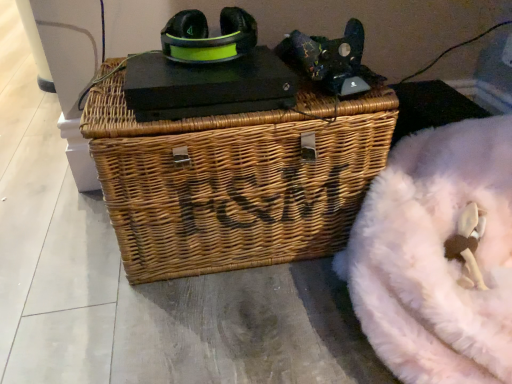
What is the approximate width of white fluffy bean bag at lower right, which is the 1th bean bag chair from bottom to top?

white fluffy bean bag at lower right, which is the 1th bean bag chair from bottom to top, is 58.94 centimeters in width.

Identify the location of woven brown picnic basket at center. (234, 179).

What is the approximate width of velvet-like pink bean bag at upper right, positioned as the 1th bean bag chair in top-to-bottom order?

It is 6.37 inches.

You are a GUI agent. You are given a task and a screenshot of the screen. Output one action in this format:
    pyautogui.click(x=<x>, y=<y>)
    Task: Click on the white fluffy bean bag at lower right, positioned as the second bean bag chair in top-to-bottom order
    
    Given the screenshot: What is the action you would take?
    pyautogui.click(x=438, y=255)

Which point is more distant from viewer, (184, 134) or (179, 21)?

The point (179, 21) is more distant.

Which of these two, woven brown picnic basket at center or matte green plastic headphones at upper center, is thinner?

matte green plastic headphones at upper center.

Do you think woven brown picnic basket at center is within matte green plastic headphones at upper center, or outside of it?

woven brown picnic basket at center is not enclosed by matte green plastic headphones at upper center.

From the image's perspective, which is below, woven brown picnic basket at center or matte green plastic headphones at upper center?

woven brown picnic basket at center appears lower in the image.

From the image's perspective, relative to woven brown picnic basket at center, is matte green plastic headphones at upper center above or below?

Clearly, from the image's perspective, matte green plastic headphones at upper center is above woven brown picnic basket at center.

Based on the photo, is matte green plastic headphones at upper center facing towards woven brown picnic basket at center?

No, matte green plastic headphones at upper center does not turn towards woven brown picnic basket at center.

From a real-world perspective, is matte green plastic headphones at upper center on woven brown picnic basket at center?

Correct, in the physical world, matte green plastic headphones at upper center is higher than woven brown picnic basket at center.

Considering the positions of objects matte green plastic headphones at upper center and woven brown picnic basket at center in the image provided, who is more to the right, matte green plastic headphones at upper center or woven brown picnic basket at center?

woven brown picnic basket at center is more to the right.

Which object is closer to the camera, velvet-like pink bean bag at upper right, positioned as the 1th bean bag chair in top-to-bottom order, or white fluffy bean bag at lower right, which is the 1th bean bag chair from bottom to top?

white fluffy bean bag at lower right, which is the 1th bean bag chair from bottom to top, is in front.

Can you confirm if velvet-like pink bean bag at upper right, acting as the 2th bean bag chair starting from the bottom, is bigger than white fluffy bean bag at lower right, which is the 1th bean bag chair from bottom to top?

No, velvet-like pink bean bag at upper right, acting as the 2th bean bag chair starting from the bottom, is not bigger than white fluffy bean bag at lower right, which is the 1th bean bag chair from bottom to top.

Is velvet-like pink bean bag at upper right, positioned as the 1th bean bag chair in top-to-bottom order, turned away from white fluffy bean bag at lower right, positioned as the second bean bag chair in top-to-bottom order?

That's not correct — velvet-like pink bean bag at upper right, positioned as the 1th bean bag chair in top-to-bottom order, is not looking away from white fluffy bean bag at lower right, positioned as the second bean bag chair in top-to-bottom order.

How distant is velvet-like pink bean bag at upper right, acting as the 2th bean bag chair starting from the bottom, from white fluffy bean bag at lower right, which is the 1th bean bag chair from bottom to top?

A distance of 11.93 inches exists between velvet-like pink bean bag at upper right, acting as the 2th bean bag chair starting from the bottom, and white fluffy bean bag at lower right, which is the 1th bean bag chair from bottom to top.

Is white fluffy bean bag at lower right, which is the 1th bean bag chair from bottom to top, spatially inside woven brown picnic basket at center, or outside of it?

white fluffy bean bag at lower right, which is the 1th bean bag chair from bottom to top, is spatially situated outside woven brown picnic basket at center.

Is white fluffy bean bag at lower right, which is the 1th bean bag chair from bottom to top, not close to woven brown picnic basket at center?

No, there isn't a large distance between white fluffy bean bag at lower right, which is the 1th bean bag chair from bottom to top, and woven brown picnic basket at center.

Which is closer to the camera, (x=357, y=56) or (x=126, y=210)?

Point (x=357, y=56) is farther from the camera than point (x=126, y=210).

Are velvet-like pink bean bag at upper right, positioned as the 1th bean bag chair in top-to-bottom order, and woven brown picnic basket at center making contact?

There is a gap between velvet-like pink bean bag at upper right, positioned as the 1th bean bag chair in top-to-bottom order, and woven brown picnic basket at center.

Considering the sizes of objects velvet-like pink bean bag at upper right, acting as the 2th bean bag chair starting from the bottom, and woven brown picnic basket at center in the image provided, who is thinner, velvet-like pink bean bag at upper right, acting as the 2th bean bag chair starting from the bottom, or woven brown picnic basket at center?

velvet-like pink bean bag at upper right, acting as the 2th bean bag chair starting from the bottom, is thinner.

Is velvet-like pink bean bag at upper right, positioned as the 1th bean bag chair in top-to-bottom order, situated inside woven brown picnic basket at center or outside?

The correct answer is: outside.

Considering the sizes of objects matte green plastic headphones at upper center and velvet-like pink bean bag at upper right, positioned as the 1th bean bag chair in top-to-bottom order, in the image provided, who is wider, matte green plastic headphones at upper center or velvet-like pink bean bag at upper right, positioned as the 1th bean bag chair in top-to-bottom order,?

Wider between the two is matte green plastic headphones at upper center.

Is matte green plastic headphones at upper center further to camera compared to velvet-like pink bean bag at upper right, acting as the 2th bean bag chair starting from the bottom?

Yes, it is.

Find the location of a particular element. Image resolution: width=512 pixels, height=384 pixels. shoe that appears above the velvet-like pink bean bag at upper right, positioned as the 1th bean bag chair in top-to-bottom order (from a real-world perspective) is located at coordinates (208, 37).

Which is correct: matte green plastic headphones at upper center is inside velvet-like pink bean bag at upper right, positioned as the 1th bean bag chair in top-to-bottom order, or outside of it?

The correct answer is: outside.

From a real-world perspective, is white fluffy bean bag at lower right, positioned as the second bean bag chair in top-to-bottom order, under matte green plastic headphones at upper center?

Yes, from a real-world perspective, white fluffy bean bag at lower right, positioned as the second bean bag chair in top-to-bottom order, is under matte green plastic headphones at upper center.

Are white fluffy bean bag at lower right, which is the 1th bean bag chair from bottom to top, and matte green plastic headphones at upper center beside each other?

No, white fluffy bean bag at lower right, which is the 1th bean bag chair from bottom to top, is not touching matte green plastic headphones at upper center.

In the scene shown: What's the angular difference between white fluffy bean bag at lower right, positioned as the second bean bag chair in top-to-bottom order, and matte green plastic headphones at upper center's facing directions?

The angle between the facing direction of white fluffy bean bag at lower right, positioned as the second bean bag chair in top-to-bottom order, and the facing direction of matte green plastic headphones at upper center is 90 degrees.

Where is `shoe above the white fluffy bean bag at lower right, positioned as the second bean bag chair in top-to-bottom order (from the image's perspective)`? shoe above the white fluffy bean bag at lower right, positioned as the second bean bag chair in top-to-bottom order (from the image's perspective) is located at coordinates (208, 37).

In order to click on shoe above the woven brown picnic basket at center (from the image's perspective) in this screenshot , I will do `click(208, 37)`.

Identify the location of picnic basket below the matte green plastic headphones at upper center (from the image's perspective). The height and width of the screenshot is (384, 512). (234, 179).

From the image, which object appears to be nearer to woven brown picnic basket at center, matte green plastic headphones at upper center or white fluffy bean bag at lower right, positioned as the second bean bag chair in top-to-bottom order?

The object closer to woven brown picnic basket at center is white fluffy bean bag at lower right, positioned as the second bean bag chair in top-to-bottom order.

Considering their positions, is woven brown picnic basket at center positioned further to matte green plastic headphones at upper center than white fluffy bean bag at lower right, positioned as the second bean bag chair in top-to-bottom order?

The object further to matte green plastic headphones at upper center is white fluffy bean bag at lower right, positioned as the second bean bag chair in top-to-bottom order.

From the image, which object appears to be nearer to velvet-like pink bean bag at upper right, positioned as the 1th bean bag chair in top-to-bottom order, white fluffy bean bag at lower right, positioned as the second bean bag chair in top-to-bottom order, or matte green plastic headphones at upper center?

matte green plastic headphones at upper center is closer to velvet-like pink bean bag at upper right, positioned as the 1th bean bag chair in top-to-bottom order.

Based on their spatial positions, is matte green plastic headphones at upper center or white fluffy bean bag at lower right, positioned as the second bean bag chair in top-to-bottom order, closer to velvet-like pink bean bag at upper right, positioned as the 1th bean bag chair in top-to-bottom order?

matte green plastic headphones at upper center is closer to velvet-like pink bean bag at upper right, positioned as the 1th bean bag chair in top-to-bottom order.

Which object lies nearer to the anchor point velvet-like pink bean bag at upper right, positioned as the 1th bean bag chair in top-to-bottom order, matte green plastic headphones at upper center or woven brown picnic basket at center?

The object closer to velvet-like pink bean bag at upper right, positioned as the 1th bean bag chair in top-to-bottom order, is matte green plastic headphones at upper center.

Which object lies nearer to the anchor point velvet-like pink bean bag at upper right, acting as the 2th bean bag chair starting from the bottom, woven brown picnic basket at center or matte green plastic headphones at upper center?

matte green plastic headphones at upper center.

Which object lies further to the anchor point white fluffy bean bag at lower right, positioned as the second bean bag chair in top-to-bottom order, velvet-like pink bean bag at upper right, acting as the 2th bean bag chair starting from the bottom, or woven brown picnic basket at center?

The object further to white fluffy bean bag at lower right, positioned as the second bean bag chair in top-to-bottom order, is velvet-like pink bean bag at upper right, acting as the 2th bean bag chair starting from the bottom.

Estimate the real-world distances between objects in this image. Which object is closer to woven brown picnic basket at center, velvet-like pink bean bag at upper right, acting as the 2th bean bag chair starting from the bottom, or matte green plastic headphones at upper center?

Based on the image, velvet-like pink bean bag at upper right, acting as the 2th bean bag chair starting from the bottom, appears to be nearer to woven brown picnic basket at center.

Locate an element on the screen. The width and height of the screenshot is (512, 384). bean bag chair between matte green plastic headphones at upper center and white fluffy bean bag at lower right, which is the 1th bean bag chair from bottom to top, in the horizontal direction is located at coordinates (330, 60).

Image resolution: width=512 pixels, height=384 pixels. Identify the location of picnic basket between matte green plastic headphones at upper center and velvet-like pink bean bag at upper right, positioned as the 1th bean bag chair in top-to-bottom order, from left to right. (234, 179).

Where is `bean bag chair located between woven brown picnic basket at center and white fluffy bean bag at lower right, which is the 1th bean bag chair from bottom to top, in the left-right direction`? The width and height of the screenshot is (512, 384). bean bag chair located between woven brown picnic basket at center and white fluffy bean bag at lower right, which is the 1th bean bag chair from bottom to top, in the left-right direction is located at coordinates 330,60.

Image resolution: width=512 pixels, height=384 pixels. I want to click on picnic basket located between matte green plastic headphones at upper center and white fluffy bean bag at lower right, positioned as the second bean bag chair in top-to-bottom order, in the left-right direction, so click(234, 179).